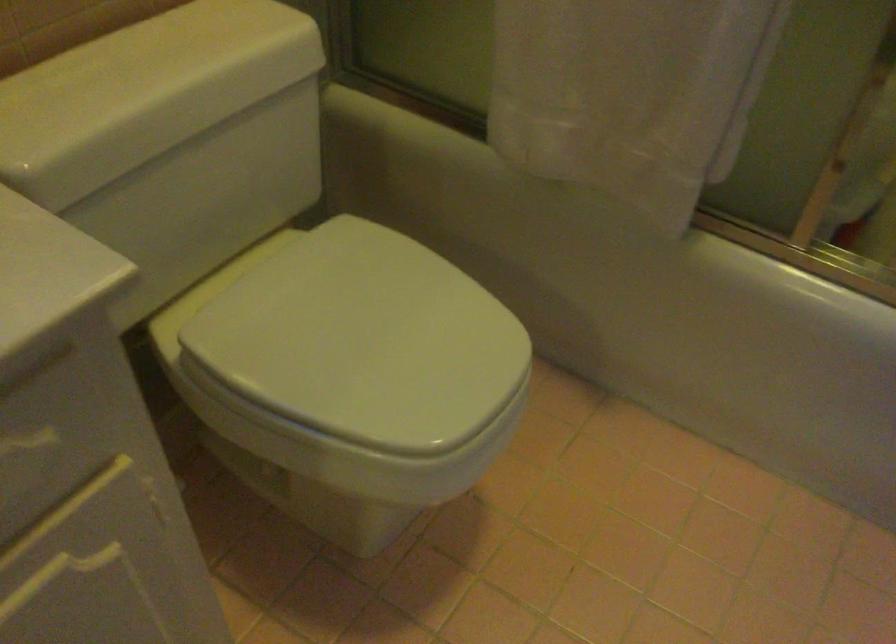
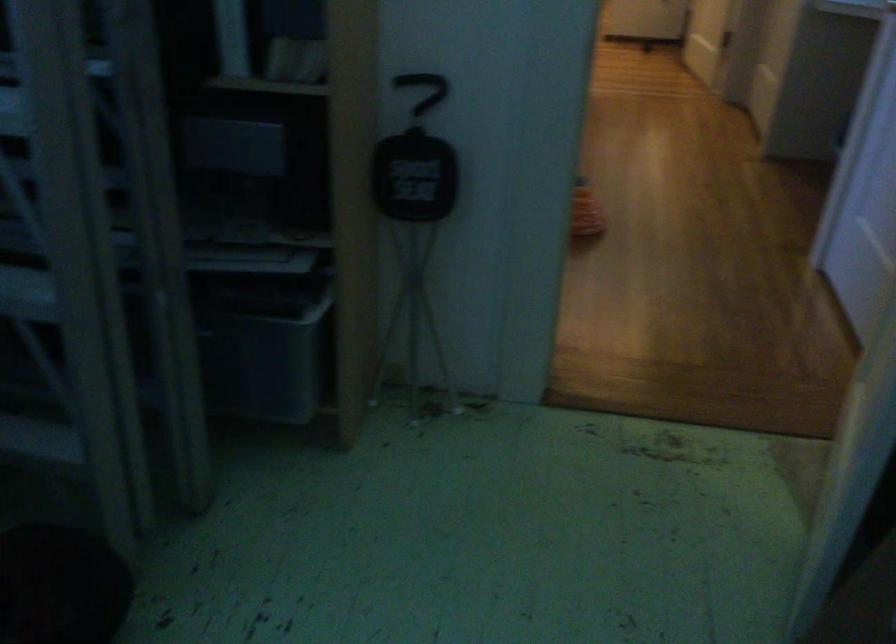
Question: The images are taken continuously from a first-person perspective. In which direction are you moving?

Choices:
 (A) Left
 (B) Right
 (C) Forward
 (D) Backward

Answer: (D)